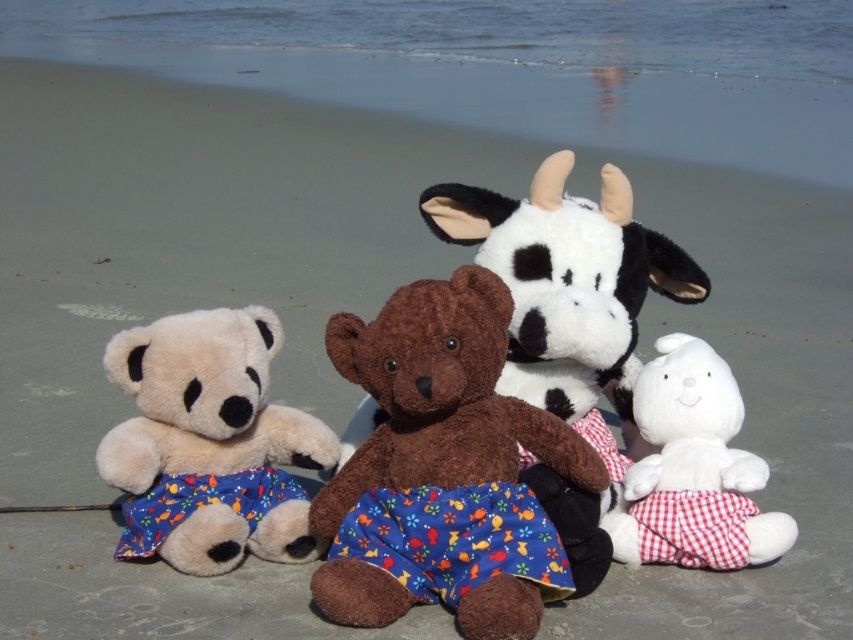
Between fluffy beige teddy bear at left and white plush rabbit at lower right, which one is positioned higher?

Positioned higher is fluffy beige teddy bear at left.

What do you see at coordinates (209, 444) in the screenshot? The image size is (853, 640). I see `fluffy beige teddy bear at left` at bounding box center [209, 444].

The height and width of the screenshot is (640, 853). I want to click on fluffy beige teddy bear at left, so click(x=209, y=444).

What do you see at coordinates (440, 397) in the screenshot?
I see `brown plush bear at center` at bounding box center [440, 397].

Which of these two, brown plush bear at center or white plush rabbit at lower right, stands taller?

brown plush bear at center

The width and height of the screenshot is (853, 640). Describe the element at coordinates (440, 397) in the screenshot. I see `brown plush bear at center` at that location.

Locate an element on the screen. This screenshot has width=853, height=640. brown plush bear at center is located at coordinates point(440,397).

Measure the distance from brown plush bear at center to fluffy beige teddy bear at left.

brown plush bear at center and fluffy beige teddy bear at left are 11.92 inches apart.

Between point (433, 417) and point (167, 378), which one is positioned in front?

Point (433, 417) is in front.

Identify the location of brown plush bear at center. (440, 397).